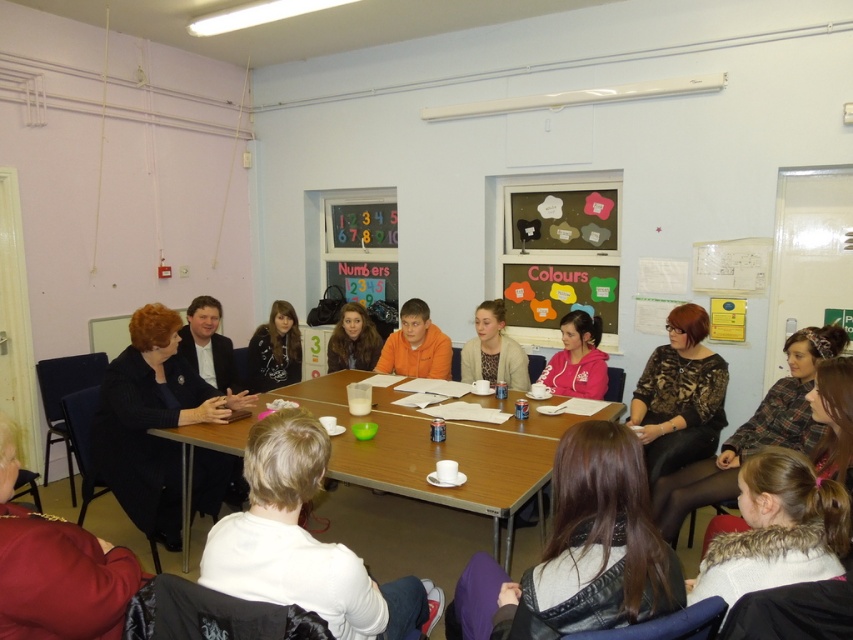
How much distance is there between wooden table at center and patterned fabric blouse at center?

wooden table at center and patterned fabric blouse at center are 67.12 centimeters apart from each other.

Between point (338, 468) and point (666, 321), which one is positioned behind?

Point (666, 321)

Based on the photo, who is more forward, (363, 483) or (631, 410)?

Point (363, 483) is more forward.

Locate an element on the screen. The width and height of the screenshot is (853, 640). wooden table at center is located at coordinates (437, 452).

Can you confirm if wooden table at center is positioned above printed fabric blouse at center?

No, wooden table at center is not above printed fabric blouse at center.

Does wooden table at center appear on the right side of printed fabric blouse at center?

In fact, wooden table at center is to the left of printed fabric blouse at center.

This screenshot has width=853, height=640. What do you see at coordinates (437, 452) in the screenshot? I see `wooden table at center` at bounding box center [437, 452].

At what (x,y) coordinates should I click in order to perform the action: click on wooden table at center. Please return your answer as a coordinate pair (x, y). Looking at the image, I should click on (437, 452).

Between point (560, 323) and point (498, 308), which one is positioned in front?

Point (498, 308)

Is point (599, 362) behind point (502, 316)?

That is False.

Which is in front, point (589, 355) or point (486, 305)?

Positioned in front is point (589, 355).

Find the location of `pink fleece jacket at center`. pink fleece jacket at center is located at coordinates (577, 358).